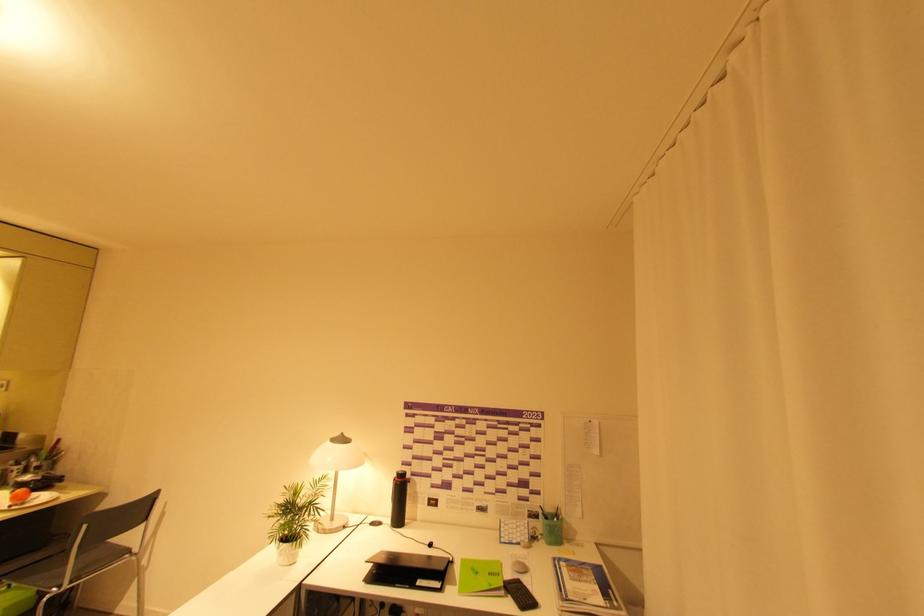
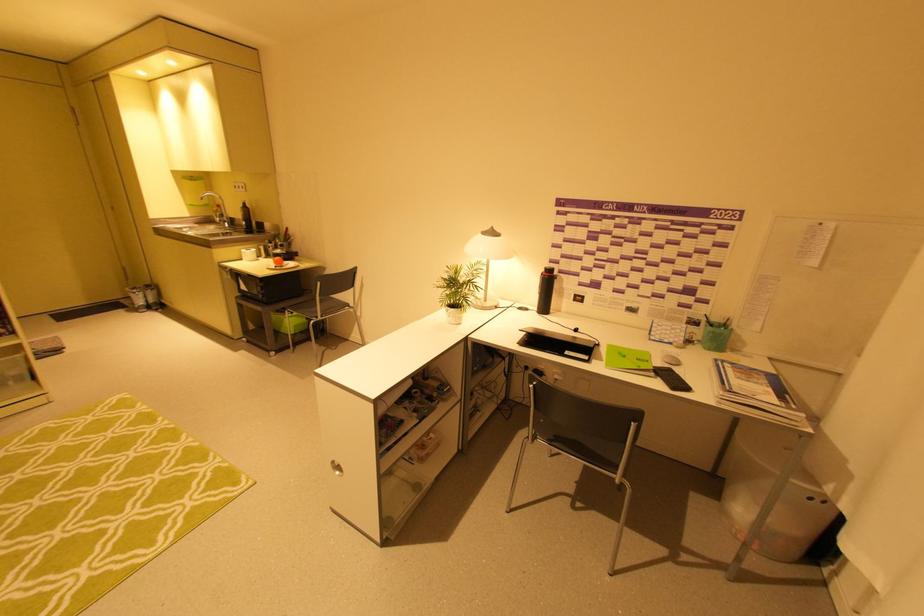
Locate, in the second image, the point that corresponds to [468,561] in the first image.

(614, 346)